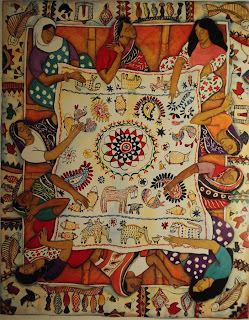
You are a GUI agent. You are given a task and a screenshot of the screen. Output one action in this format:
    pyautogui.click(x=<x>, y=<y>)
    Task: Click on the quilt
    The image size is (249, 320).
    Given the screenshot: What is the action you would take?
    pyautogui.click(x=82, y=100)